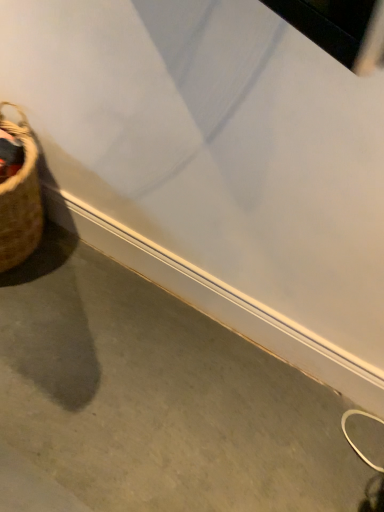
Question: Should I look upward or downward to see gray concrete at lower left?

Choices:
 (A) up
 (B) down

Answer: (B)